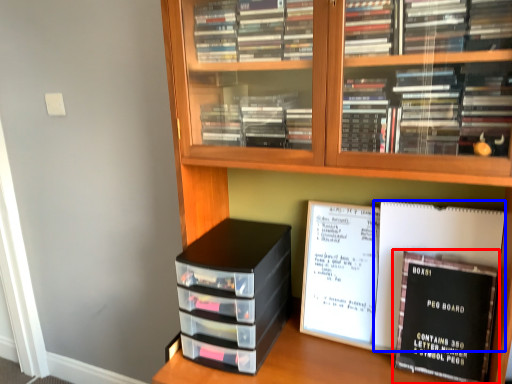
Question: Which object appears closest to the camera in this image, book (highlighted by a red box) or journal (highlighted by a blue box)?

Choices:
 (A) book
 (B) journal

Answer: (A)